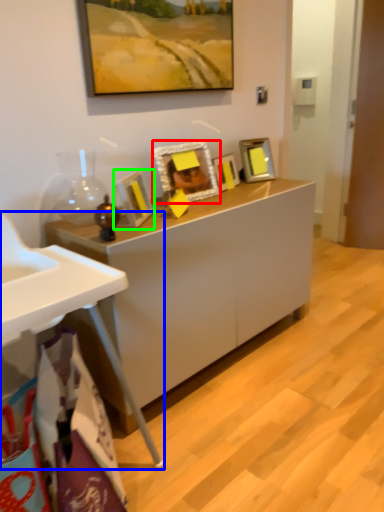
Question: Which object is the farthest from picture frame (highlighted by a red box)? Choose among these: table (highlighted by a blue box) or picture frame (highlighted by a green box).

Choices:
 (A) table
 (B) picture frame

Answer: (A)